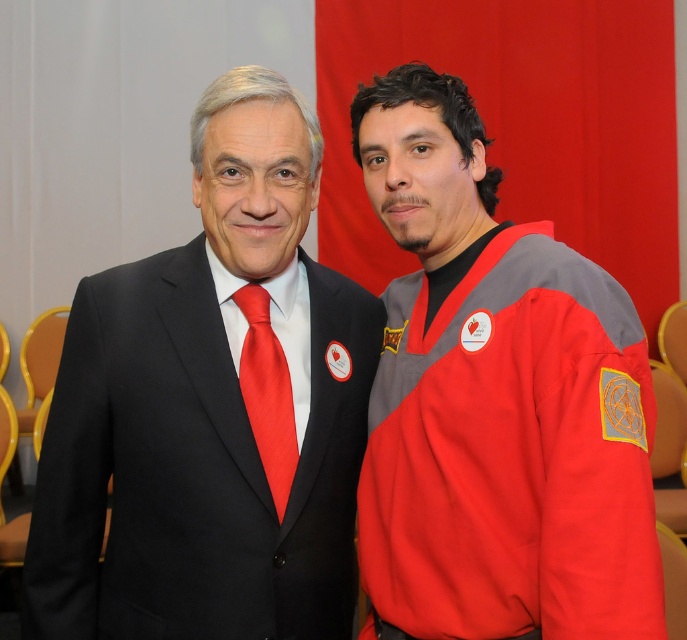
Between point (339, 280) and point (551, 324), which one is positioned behind?

The point (339, 280) is behind.

Can you confirm if matte black suit at center is positioned below matte red hockey jersey at right?

No, matte black suit at center is not below matte red hockey jersey at right.

Who is more distant from viewer, (x=315, y=308) or (x=561, y=497)?

Positioned behind is point (x=315, y=308).

Locate an element on the screen. This screenshot has height=640, width=687. matte black suit at center is located at coordinates (212, 408).

Is matte black suit at center shorter than shiny silk tie at center?

No, matte black suit at center is not shorter than shiny silk tie at center.

Is matte black suit at center thinner than shiny silk tie at center?

Incorrect, matte black suit at center's width is not less than shiny silk tie at center's.

Locate an element on the screen. matte black suit at center is located at coordinates (212, 408).

Who is more distant from viewer, (x=563, y=552) or (x=273, y=339)?

Answer: The point (x=273, y=339) is behind.

Does matte red hockey jersey at right appear under shiny silk tie at center?

No.

Which is in front, point (372, 625) or point (262, 356)?

Point (262, 356) is in front.

Locate an element on the screen. matte red hockey jersey at right is located at coordinates (495, 403).